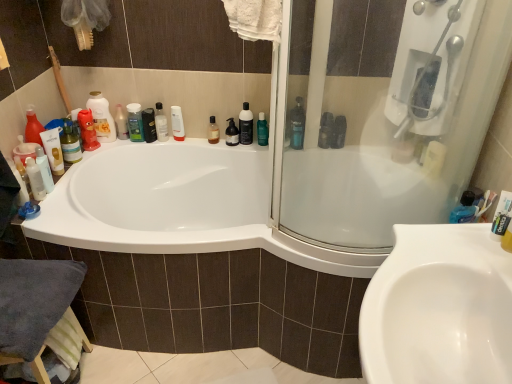
Question: Considering the positions of brown glass bottle at upper center, the second mouthwash positioned from the left, and blue glossy bottle at upper right, the 4th cleaning product positioned from the left, in the image, is brown glass bottle at upper center, the second mouthwash positioned from the left, wider or thinner than blue glossy bottle at upper right, the 4th cleaning product positioned from the left,?

Choices:
 (A) thin
 (B) wide

Answer: (A)

Question: From their relative heights in the image, would you say brown glass bottle at upper center, which appears as the third mouthwash when viewed from the right, is taller or shorter than blue glossy bottle at upper right, the 4th cleaning product positioned from the left?

Choices:
 (A) short
 (B) tall

Answer: (A)

Question: Which object is the farthest from the white plastic shower at upper right?

Choices:
 (A) green matte shampoo at upper left, the 2th toiletry positioned from the left
 (B) white glossy bottle at upper center, which is the fourth mouthwash from right to left
 (C) translucent plastic bottle at upper left, which is the 2th cleaning product from left to right
 (D) matte white lotion at upper center, positioned as the 3th toiletry in right-to-left order
 (E) black glossy bottle at upper center, marked as the third mouthwash in a left-to-right arrangement

Answer: (C)

Question: Based on their relative distances, which object is farther from the black pump bottle at upper center, which ranks as the 1th toiletry in right-to-left order?

Choices:
 (A) matte white lotion at upper center, positioned as the 3th toiletry in right-to-left order
 (B) translucent plastic bottle at upper center, the second cleaning product when ordered from right to left
 (C) black glossy bottle at upper center, marked as the third mouthwash in a left-to-right arrangement
 (D) green matte shampoo at upper left, the 2th toiletry positioned from the left
 (E) white glossy bottle at upper center, which is the fourth mouthwash from right to left

Answer: (A)